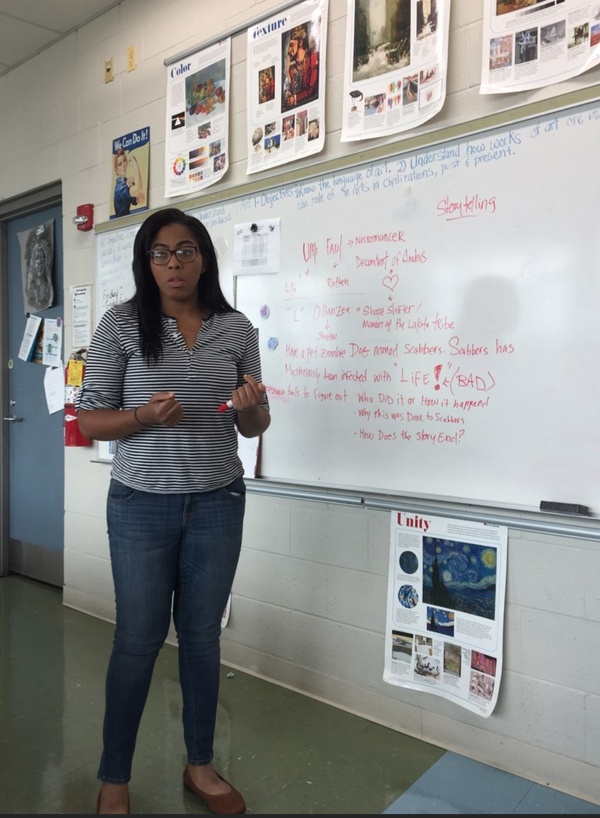
Identify the location of floor. This screenshot has width=600, height=818. coord(337,762).